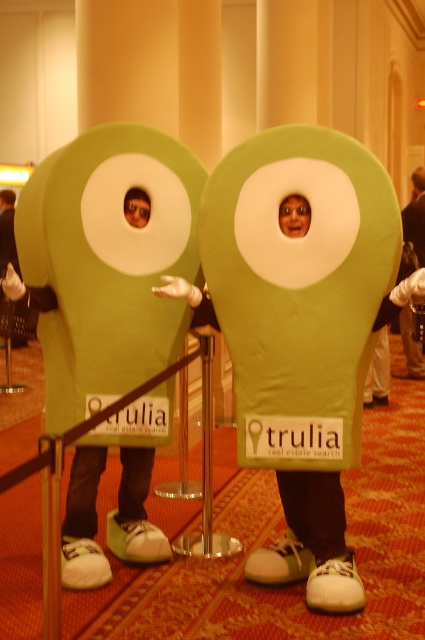
Question: Is the position of green fabric costume at center less distant than that of matte green eye at center?

Choices:
 (A) no
 (B) yes

Answer: (A)

Question: Does smooth matte face at center come behind matte green eye at center?

Choices:
 (A) yes
 (B) no

Answer: (B)

Question: Which point is farther from the camera taking this photo?

Choices:
 (A) (138, 221)
 (B) (402, 324)

Answer: (B)

Question: Can you confirm if green fabric costume at center is thinner than matte green eye at center?

Choices:
 (A) no
 (B) yes

Answer: (A)

Question: Among these objects, which one is nearest to the camera?

Choices:
 (A) matte green eye at center
 (B) smooth matte face at center

Answer: (B)

Question: Considering the real-world distances, which object is farthest from the smooth matte face at center?

Choices:
 (A) green fabric costume at center
 (B) matte green eye at center

Answer: (A)